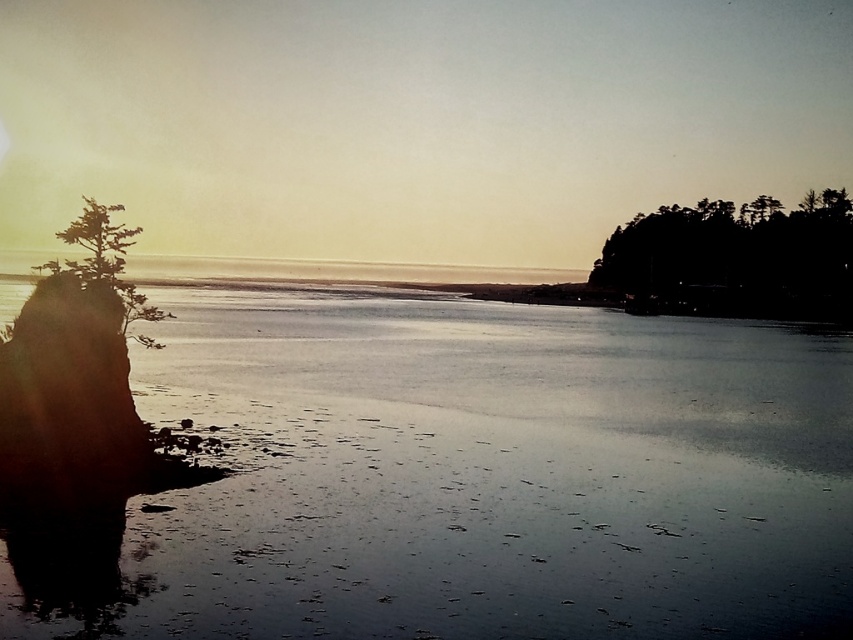
Where is `smooth sand beach at left`? This screenshot has height=640, width=853. smooth sand beach at left is located at coordinates (490, 476).

Is smooth sand beach at left further to camera compared to green matte tree at left?

No, smooth sand beach at left is in front of green matte tree at left.

Identify the location of smooth sand beach at left. (490, 476).

Identify the location of smooth sand beach at left. (490, 476).

From the picture: Does smooth sand beach at left have a smaller size compared to silhouette/black trees at right?

Correct, smooth sand beach at left occupies less space than silhouette/black trees at right.

Does point (363, 525) lie in front of point (772, 285)?

Yes, point (363, 525) is closer to viewer.

Who is more forward, (302, 584) or (654, 268)?

Point (302, 584) is in front.

Locate an element on the screen. This screenshot has height=640, width=853. smooth sand beach at left is located at coordinates (490, 476).

Can you confirm if silhouette/black trees at right is taller than green matte tree at left?

Correct, silhouette/black trees at right is much taller as green matte tree at left.

Is silhouette/black trees at right to the left of green matte tree at left from the viewer's perspective?

Incorrect, silhouette/black trees at right is not on the left side of green matte tree at left.

Identify the location of silhouette/black trees at right. The height and width of the screenshot is (640, 853). (737, 257).

At what (x,y) coordinates should I click in order to perform the action: click on silhouette/black trees at right. Please return your answer as a coordinate pair (x, y). Looking at the image, I should click on (737, 257).